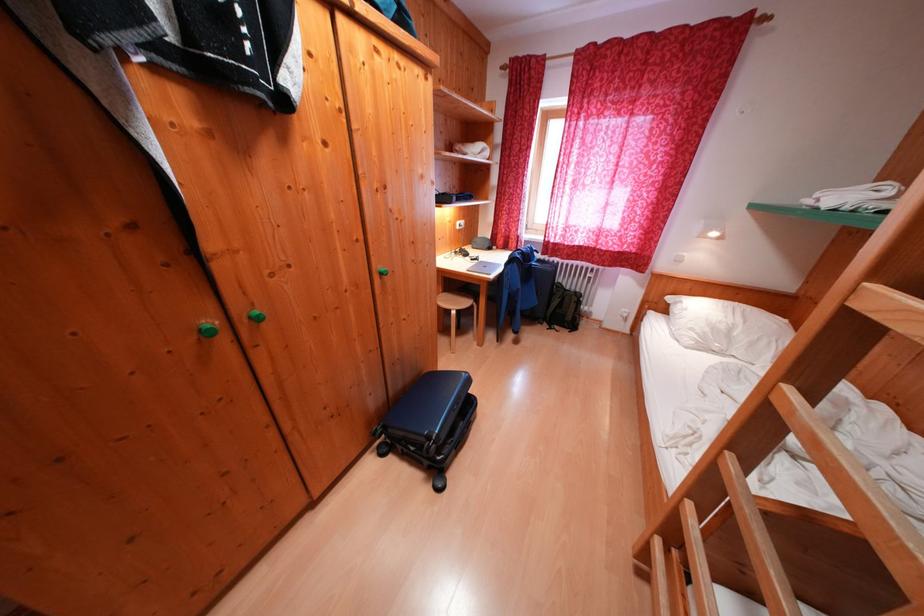
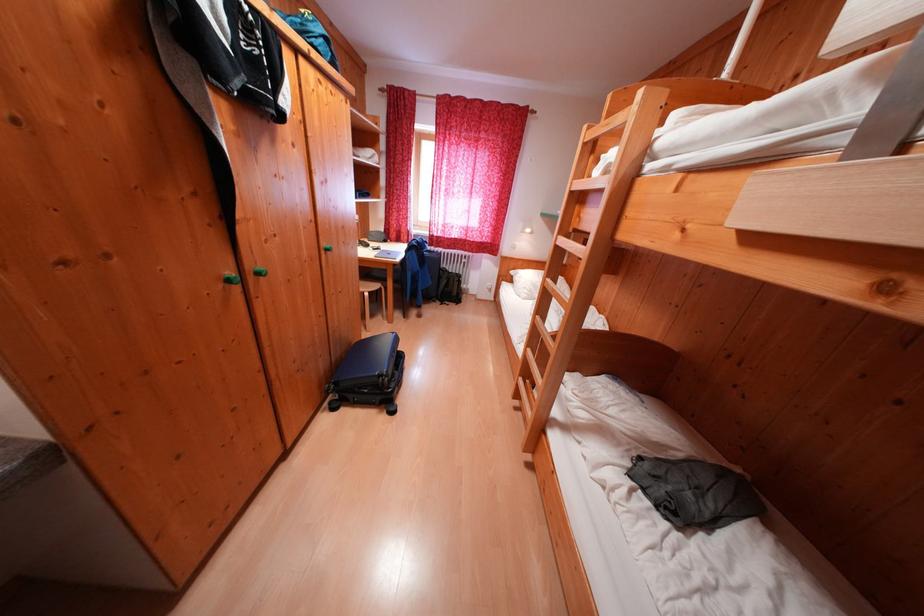
The point at (x=473, y=307) is marked in the first image. Where is the corresponding point in the second image?

(383, 290)